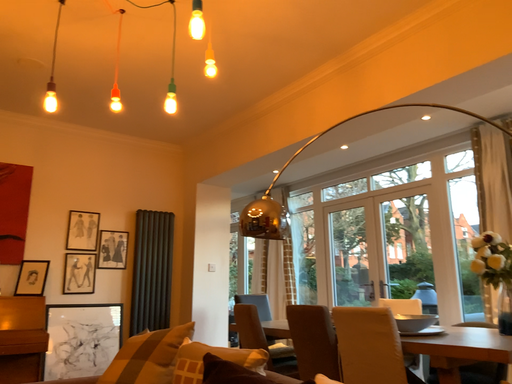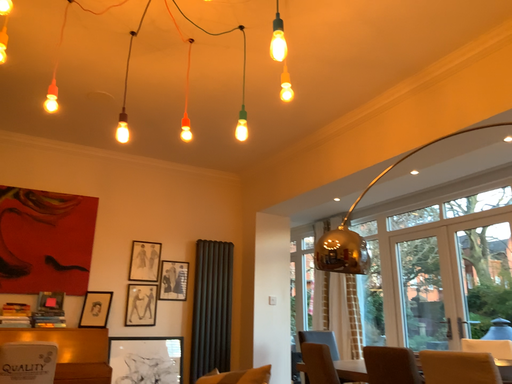
Question: How did the camera likely rotate when shooting the video?

Choices:
 (A) rotated left
 (B) rotated right

Answer: (A)